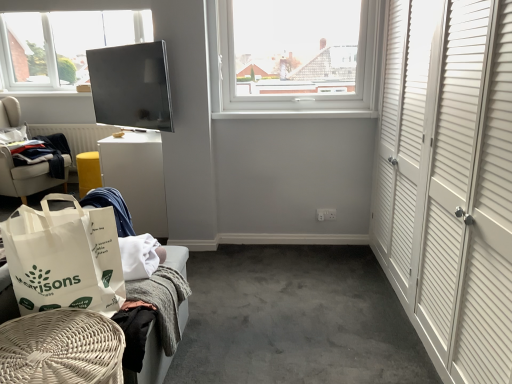
Describe the element at coordinates (131, 86) in the screenshot. The width and height of the screenshot is (512, 384). I see `matte black tv at upper center` at that location.

Consider the image. Measure the distance between point (x=72, y=256) and camera.

A distance of 4.41 feet exists between point (x=72, y=256) and camera.

What do you see at coordinates (293, 57) in the screenshot? I see `white plastic window at upper center` at bounding box center [293, 57].

Find the location of a particular element. The width and height of the screenshot is (512, 384). white fabric chair at left, the first furniture positioned from the left is located at coordinates (27, 177).

Locate an element on the screen. The height and width of the screenshot is (384, 512). window screen that is above the white fabric chair at left, which ranks as the third furniture in right-to-left order (from a real-world perspective) is located at coordinates (131, 86).

From the image's perspective, is white fabric chair at left, the first furniture positioned from the left, positioned above or below matte black tv at upper center?

white fabric chair at left, the first furniture positioned from the left, is situated lower than matte black tv at upper center in the image.

What's the angular difference between white fabric chair at left, the third furniture in the front-to-back sequence, and matte black tv at upper center's facing directions?

There is a 111-degree angle between the facing directions of white fabric chair at left, the third furniture in the front-to-back sequence, and matte black tv at upper center.

Considering the sizes of objects white fabric chair at left, which appears as the first furniture when viewed from the top, and matte black tv at upper center in the image provided, who is shorter, white fabric chair at left, which appears as the first furniture when viewed from the top, or matte black tv at upper center?

With less height is matte black tv at upper center.

Between point (163, 236) and point (57, 366), which one is positioned behind?

The point (163, 236) is farther.

Image resolution: width=512 pixels, height=384 pixels. In order to click on the 1st table located beneath the white wicker basket at lower left, which is the first furniture in bottom-to-top order (from a real-world perspective) in this screenshot , I will do `click(137, 178)`.

Is white glossy table at center-left, which is counted as the 1th table, starting from the front, aimed at white wicker basket at lower left, the 1th furniture in the right-to-left sequence?

No, white glossy table at center-left, which is counted as the 1th table, starting from the front, is not oriented towards white wicker basket at lower left, the 1th furniture in the right-to-left sequence.

Is dark blue fabric at left smaller than white glossy table at center-left, which is counted as the 1th table, starting from the front?

Yes.

There is a white glossy table at center-left, the 2th table positioned from the left. Identify the location of clothing above it (from a real-world perspective). This screenshot has width=512, height=384. [46, 154].

From a real-world perspective, is dark blue fabric at left located higher than white glossy table at center-left, which is counted as the 1th table, starting from the front?

Yes, from a real-world perspective, dark blue fabric at left is over white glossy table at center-left, which is counted as the 1th table, starting from the front

Could you tell me if yellow fabric stool at lower left, positioned as the 2th table in front-to-back order, is turned towards white woven basket at lower left, marked as the 2th furniture in a front-to-back arrangement?

No, yellow fabric stool at lower left, positioned as the 2th table in front-to-back order, is not oriented towards white woven basket at lower left, marked as the 2th furniture in a front-to-back arrangement.

Does point (79, 173) lie behind point (146, 354)?

Yes, it is.

From the image's perspective, which is above, yellow fabric stool at lower left, the first table viewed from the back, or white woven basket at lower left, acting as the 2th furniture starting from the bottom?

yellow fabric stool at lower left, the first table viewed from the back, from the image's perspective.

Considering the sizes of objects yellow fabric stool at lower left, the second table positioned from the right, and white woven basket at lower left, marked as the 2th furniture in a front-to-back arrangement, in the image provided, who is taller, yellow fabric stool at lower left, the second table positioned from the right, or white woven basket at lower left, marked as the 2th furniture in a front-to-back arrangement,?

white woven basket at lower left, marked as the 2th furniture in a front-to-back arrangement.

Which is correct: white wicker basket at lower left, the 1th furniture in the right-to-left sequence, is inside white paper bag at lower left, or outside of it?

white wicker basket at lower left, the 1th furniture in the right-to-left sequence, is located beyond the bounds of white paper bag at lower left.

Find the location of a particular element. This screenshot has height=384, width=512. the 2nd furniture below the white paper bag at lower left (from the image's perspective) is located at coordinates (61, 349).

Is white wicker basket at lower left, acting as the third furniture starting from the back, facing towards white paper bag at lower left?

No, white wicker basket at lower left, acting as the third furniture starting from the back, is not turned towards white paper bag at lower left.

In the scene shown: Is white wicker basket at lower left, the 1th furniture in the right-to-left sequence, bigger or smaller than white paper bag at lower left?

In the image, white wicker basket at lower left, the 1th furniture in the right-to-left sequence, appears to be larger than white paper bag at lower left.

Considering the relative sizes of yellow fabric stool at lower left, positioned as the 2th table in front-to-back order, and white paper bag at lower left in the image provided, is yellow fabric stool at lower left, positioned as the 2th table in front-to-back order, bigger than white paper bag at lower left?

Incorrect, yellow fabric stool at lower left, positioned as the 2th table in front-to-back order, is not larger than white paper bag at lower left.

Looking at this image, which object is thinner, yellow fabric stool at lower left, the second table positioned from the right, or white paper bag at lower left?

With smaller width is yellow fabric stool at lower left, the second table positioned from the right.

Consider the image. From the image's perspective, between yellow fabric stool at lower left, the second table positioned from the right, and white paper bag at lower left, who is located below?

white paper bag at lower left.

Which is closer, (86, 174) or (68, 253)?

Point (86, 174) is positioned farther from the camera compared to point (68, 253).

Can you tell me how much white woven basket at lower left, which is the second furniture in back-to-front order, and white wicker basket at lower left, which is the first furniture in bottom-to-top order, differ in facing direction?

The angle between the facing direction of white woven basket at lower left, which is the second furniture in back-to-front order, and the facing direction of white wicker basket at lower left, which is the first furniture in bottom-to-top order, is 0.194 degrees.

Considering the relative positions of white woven basket at lower left, the second furniture viewed from the right, and white wicker basket at lower left, which is the third furniture in top-to-bottom order, in the image provided, is white woven basket at lower left, the second furniture viewed from the right, to the left or to the right of white wicker basket at lower left, which is the third furniture in top-to-bottom order,?

white woven basket at lower left, the second furniture viewed from the right, is positioned on white wicker basket at lower left, which is the third furniture in top-to-bottom order,'s left side.

How much distance is there between white woven basket at lower left, the second furniture viewed from the right, and white wicker basket at lower left, which is counted as the first furniture, starting from the front?

13.12 inches.

From a real-world perspective, is white woven basket at lower left, acting as the 2th furniture starting from the bottom, on white wicker basket at lower left, the 1th furniture in the right-to-left sequence?

Yes, from a real-world perspective, white woven basket at lower left, acting as the 2th furniture starting from the bottom, is above white wicker basket at lower left, the 1th furniture in the right-to-left sequence.

The height and width of the screenshot is (384, 512). Identify the location of furniture that is the 1st object directly below the matte black tv at upper center (from a real-world perspective). (27, 177).

From the white glossy table at center-left, the 2th table positioned from the left, count 2nd furniture to the right and point to it. Please provide its 2D coordinates.

[(61, 349)]

Which object lies further to the anchor point white paper bag at lower left, matte black tv at upper center or yellow fabric stool at lower left, the first table viewed from the back?

yellow fabric stool at lower left, the first table viewed from the back, lies further to white paper bag at lower left than the other object.

Considering their positions, is dark blue fabric at left positioned closer to white fabric chair at left, the first furniture positioned from the left, than white wicker basket at lower left, which is counted as the first furniture, starting from the front?

The object closer to white fabric chair at left, the first furniture positioned from the left, is dark blue fabric at left.

Looking at the image, which one is located further to white wicker basket at lower left, which is counted as the first furniture, starting from the front, dark blue fabric at left or matte black tv at upper center?

Based on the image, dark blue fabric at left appears to be further to white wicker basket at lower left, which is counted as the first furniture, starting from the front.

Based on their spatial positions, is yellow fabric stool at lower left, positioned as the 2th table in front-to-back order, or white fabric chair at left, the third furniture in the front-to-back sequence, closer to white plastic window at upper center?

yellow fabric stool at lower left, positioned as the 2th table in front-to-back order, lies closer to white plastic window at upper center than the other object.

Based on the photo, looking at the image, which one is located closer to yellow fabric stool at lower left, arranged as the first table when viewed from the left, white fabric chair at left, which ranks as the third furniture in right-to-left order, or white wicker basket at lower left, placed as the third furniture when sorted from left to right?

white fabric chair at left, which ranks as the third furniture in right-to-left order, is closer to yellow fabric stool at lower left, arranged as the first table when viewed from the left.

Based on the photo, estimate the real-world distances between objects in this image. Which object is closer to white fabric chair at left, the first furniture positioned from the left, dark blue fabric at left or white glossy table at center-left, which is the 2th table from back to front?

dark blue fabric at left lies closer to white fabric chair at left, the first furniture positioned from the left, than the other object.

When comparing their distances from white fabric chair at left, placed as the third furniture when sorted from bottom to top, does yellow fabric stool at lower left, the second table positioned from the right, or white plastic window at upper center seem closer?

yellow fabric stool at lower left, the second table positioned from the right, lies closer to white fabric chair at left, placed as the third furniture when sorted from bottom to top, than the other object.

Estimate the real-world distances between objects in this image. Which object is further from white woven basket at lower left, positioned as the second furniture in top-to-bottom order, white paper bag at lower left or matte black tv at upper center?

matte black tv at upper center is positioned further to the anchor white woven basket at lower left, positioned as the second furniture in top-to-bottom order.

The image size is (512, 384). I want to click on table between white paper bag at lower left and white fabric chair at left, the third furniture in the front-to-back sequence, along the z-axis, so click(x=137, y=178).

You are a GUI agent. You are given a task and a screenshot of the screen. Output one action in this format:
    pyautogui.click(x=<x>, y=<y>)
    Task: Click on the table positioned between white wicker basket at lower left, the 1th furniture in the right-to-left sequence, and yellow fabric stool at lower left, positioned as the 2th table in front-to-back order, from near to far
    The image size is (512, 384).
    Given the screenshot: What is the action you would take?
    (x=137, y=178)

The width and height of the screenshot is (512, 384). I want to click on bag between white wicker basket at lower left, which is the first furniture in bottom-to-top order, and yellow fabric stool at lower left, arranged as the first table when viewed from the left, in the front-back direction, so click(x=64, y=258).

This screenshot has height=384, width=512. Find the location of `table between white woven basket at lower left, marked as the 2th furniture in a front-to-back arrangement, and white fabric chair at left, which appears as the 1th furniture when viewed from the back, along the z-axis`. table between white woven basket at lower left, marked as the 2th furniture in a front-to-back arrangement, and white fabric chair at left, which appears as the 1th furniture when viewed from the back, along the z-axis is located at coordinates (137, 178).